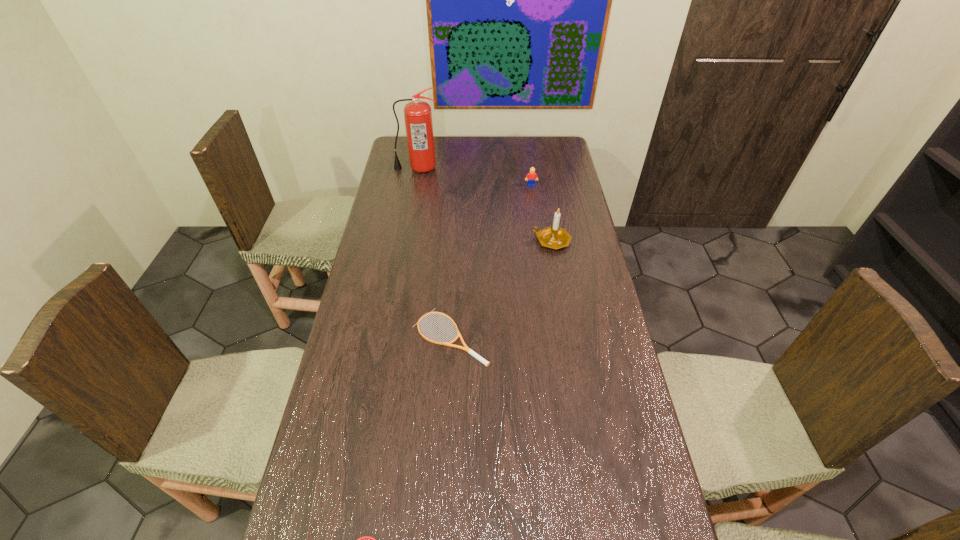
The image size is (960, 540). Identify the location of fire extinguisher. (417, 114).

Locate an element on the screen. This screenshot has height=540, width=960. the farthest object is located at coordinates (417, 114).

Where is `candle holder`? candle holder is located at coordinates (554, 237).

At what (x,y) coordinates should I click in order to perform the action: click on the third nearest object. Please return your answer as a coordinate pair (x, y). This screenshot has height=540, width=960. Looking at the image, I should click on (554, 237).

Find the location of `the third tallest object`. the third tallest object is located at coordinates (532, 176).

At what (x,y) coordinates should I click in order to perform the action: click on the fourth nearest object. Please return your answer as a coordinate pair (x, y). The height and width of the screenshot is (540, 960). Looking at the image, I should click on (532, 176).

I want to click on the taller tennis racket, so click(x=466, y=348).

Locate an element on the screen. The width and height of the screenshot is (960, 540). the fourth farthest object is located at coordinates (466, 348).

Locate an element on the screen. The height and width of the screenshot is (540, 960). vacant space situated 0.140m on the instruction side of the fire extinguisher is located at coordinates (413, 194).

Where is `vacant space located on the left of the third nearest object`? vacant space located on the left of the third nearest object is located at coordinates (510, 241).